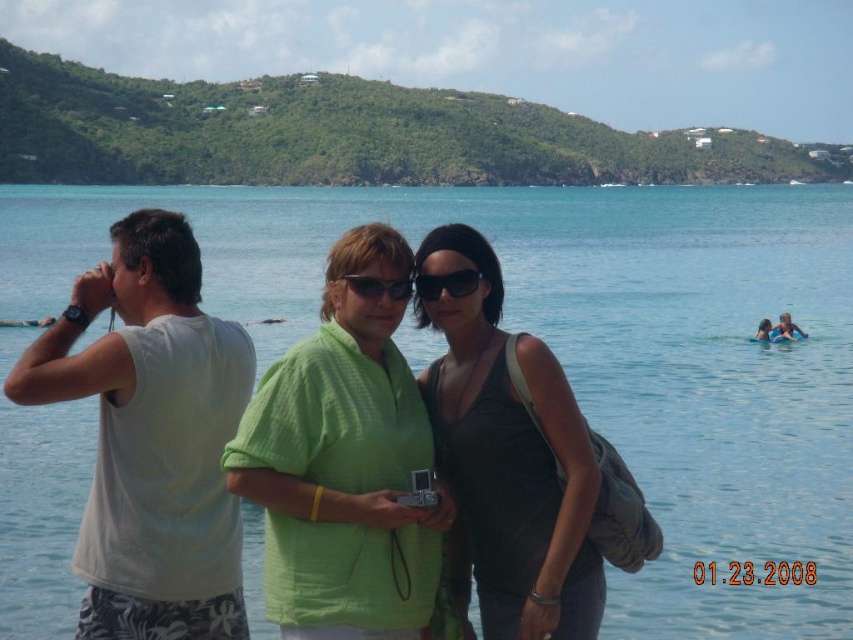
Question: Which of the following is the farthest from the observer?

Choices:
 (A) green matte sunglasses at center
 (B) white cotton shirt at left

Answer: (A)

Question: Which object is the farthest from the black matte tank top at center?

Choices:
 (A) white cotton shirt at left
 (B) green cotton shirt at center
 (C) clear blue water at center

Answer: (C)

Question: Does black matte tank top at center appear on the left side of black plastic sunglasses at center?

Choices:
 (A) no
 (B) yes

Answer: (A)

Question: Does clear blue water at center lie behind black matte tank top at center?

Choices:
 (A) no
 (B) yes

Answer: (B)

Question: Does white cotton shirt at left have a greater width compared to green matte sunglasses at center?

Choices:
 (A) no
 (B) yes

Answer: (B)

Question: Among these points, which one is farthest from the camera?

Choices:
 (A) (402, 285)
 (B) (241, 288)
 (C) (264, 406)
 (D) (491, 301)

Answer: (B)